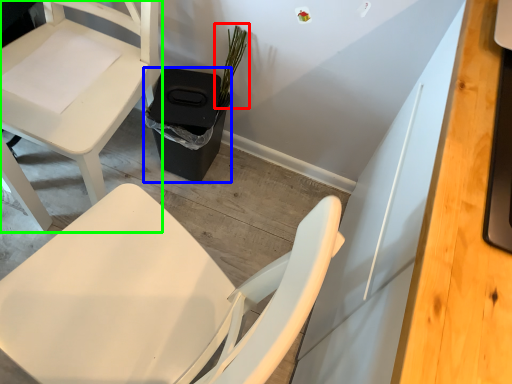
Question: Considering the real-world distances, which object is closest to plant (highlighted by a red box)? trash bin/can (highlighted by a blue box) or chair (highlighted by a green box).

Choices:
 (A) trash bin/can
 (B) chair

Answer: (A)